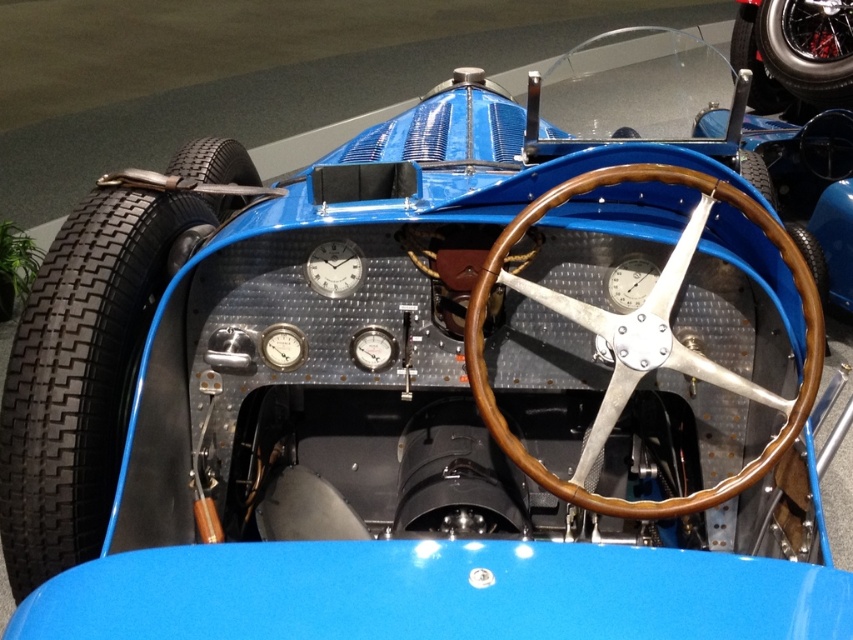
Can you confirm if shiny black tire at upper right is smaller than brown wood steering wheel at center?

No.

Does shiny black tire at upper right have a lesser height compared to brown wood steering wheel at center?

In fact, shiny black tire at upper right may be taller than brown wood steering wheel at center.

Who is more forward, [790,68] or [740,161]?

Point [740,161]

What are the coordinates of `shiny black tire at upper right` in the screenshot? It's located at (807, 48).

Is shiny chrome wheel at upper right above brown wood steering wheel at center?

Yes, shiny chrome wheel at upper right is above brown wood steering wheel at center.

Between point (747, 49) and point (753, 150), which one is positioned in front?

Positioned in front is point (753, 150).

Who is more distant from viewer, (755, 26) or (740, 170)?

Positioned behind is point (755, 26).

This screenshot has width=853, height=640. In order to click on shiny chrome wheel at upper right in this screenshot , I will do `click(755, 61)`.

Between black rubber tire at left and shiny chrome wheel at upper right, which one appears on the left side from the viewer's perspective?

black rubber tire at left is more to the left.

Does point (57, 486) come farther from viewer compared to point (762, 93)?

No, (57, 486) is closer to viewer.

You are a GUI agent. You are given a task and a screenshot of the screen. Output one action in this format:
    pyautogui.click(x=<x>, y=<y>)
    Task: Click on the black rubber tire at left
    The height and width of the screenshot is (640, 853).
    Given the screenshot: What is the action you would take?
    pyautogui.click(x=83, y=371)